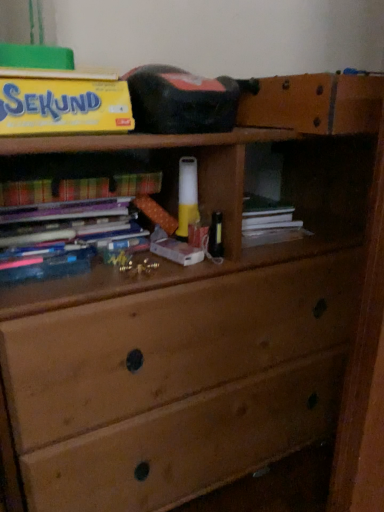
Image resolution: width=384 pixels, height=512 pixels. Describe the element at coordinates (63, 105) in the screenshot. I see `yellow matte paper at upper left` at that location.

Where is `yellow matte paper at upper left`? yellow matte paper at upper left is located at coordinates tap(63, 105).

Measure the distance between point (63, 99) and camera.

64.50 centimeters.

Locate an element on the screen. The height and width of the screenshot is (512, 384). multicolored paper book at left is located at coordinates (78, 188).

What do you see at coordinates (78, 188) in the screenshot? This screenshot has width=384, height=512. I see `multicolored paper book at left` at bounding box center [78, 188].

Identify the location of yellow matte paper at upper left. (63, 105).

Considering the positions of objects yellow matte paper at upper left and multicolored paper book at left in the image provided, who is more to the left, yellow matte paper at upper left or multicolored paper book at left?

yellow matte paper at upper left.

Which object is closer to the camera, yellow matte paper at upper left or multicolored paper book at left?

yellow matte paper at upper left is closer to the camera.

Which is in front, point (127, 122) or point (155, 173)?

Positioned in front is point (127, 122).

From the image's perspective, does yellow matte paper at upper left appear higher than multicolored paper book at left?

Yes, from the image's perspective, yellow matte paper at upper left is on top of multicolored paper book at left.

From a real-world perspective, which object rests below the other?

From a 3D spatial view, multicolored paper book at left is below.

Considering the relative sizes of yellow matte paper at upper left and multicolored paper book at left in the image provided, is yellow matte paper at upper left wider than multicolored paper book at left?

Correct, the width of yellow matte paper at upper left exceeds that of multicolored paper book at left.

Considering the sizes of yellow matte paper at upper left and multicolored paper book at left in the image, is yellow matte paper at upper left taller or shorter than multicolored paper book at left?

yellow matte paper at upper left is taller than multicolored paper book at left.

Does yellow matte paper at upper left have a smaller size compared to multicolored paper book at left?

Actually, yellow matte paper at upper left might be larger than multicolored paper book at left.

Do you think yellow matte paper at upper left is within multicolored paper book at left, or outside of it?

yellow matte paper at upper left exists outside the volume of multicolored paper book at left.

Are yellow matte paper at upper left and multicolored paper book at left making contact?

yellow matte paper at upper left and multicolored paper book at left are not in contact.

Is multicolored paper book at left at the back of yellow matte paper at upper left?

That's not correct — yellow matte paper at upper left is not looking away from multicolored paper book at left.

Find the location of a particular element. The image size is (384, 512). book located behind the yellow matte paper at upper left is located at coordinates (78, 188).

In the image, is multicolored paper book at left on the left side or the right side of yellow matte paper at upper left?

multicolored paper book at left is to the right of yellow matte paper at upper left.

Considering the positions of objects multicolored paper book at left and yellow matte paper at upper left in the image provided, who is in front, multicolored paper book at left or yellow matte paper at upper left?

Positioned in front is yellow matte paper at upper left.

Which point is more forward, (x=49, y=181) or (x=77, y=90)?

The point (x=77, y=90) is closer.

From the image's perspective, is multicolored paper book at left located above or below yellow matte paper at upper left?

multicolored paper book at left is situated lower than yellow matte paper at upper left in the image.

From a real-world perspective, is multicolored paper book at left on top of yellow matte paper at upper left?

No.

Is multicolored paper book at left wider or thinner than yellow matte paper at upper left?

In the image, multicolored paper book at left appears to be more narrow than yellow matte paper at upper left.

Which of these two, multicolored paper book at left or yellow matte paper at upper left, stands shorter?

With less height is multicolored paper book at left.

Considering the sizes of objects multicolored paper book at left and yellow matte paper at upper left in the image provided, who is bigger, multicolored paper book at left or yellow matte paper at upper left?

Bigger between the two is yellow matte paper at upper left.

Would you say multicolored paper book at left is inside or outside yellow matte paper at upper left?

multicolored paper book at left is not inside yellow matte paper at upper left, it's outside.

Are multicolored paper book at left and yellow matte paper at upper left making contact?

No, multicolored paper book at left is not next to yellow matte paper at upper left.

Does multicolored paper book at left turn towards yellow matte paper at upper left?

No, multicolored paper book at left is not facing towards yellow matte paper at upper left.

How different are the orientations of multicolored paper book at left and yellow matte paper at upper left in degrees?

There is a 0.94-degree angle between the facing directions of multicolored paper book at left and yellow matte paper at upper left.

Based on the photo, how far apart are multicolored paper book at left and yellow matte paper at upper left?

multicolored paper book at left is 6.27 inches away from yellow matte paper at upper left.

This screenshot has height=512, width=384. What are the coordinates of `paperback book above the multicolored paper book at left (from a real-world perspective)` in the screenshot? It's located at (63, 105).

You are a GUI agent. You are given a task and a screenshot of the screen. Output one action in this format:
    pyautogui.click(x=<x>, y=<y>)
    Task: Click on the book that is on the right side of yellow matte paper at upper left
    
    Given the screenshot: What is the action you would take?
    pyautogui.click(x=78, y=188)

Where is `paperback book that appears in front of the multicolored paper book at left`? paperback book that appears in front of the multicolored paper book at left is located at coordinates (63, 105).